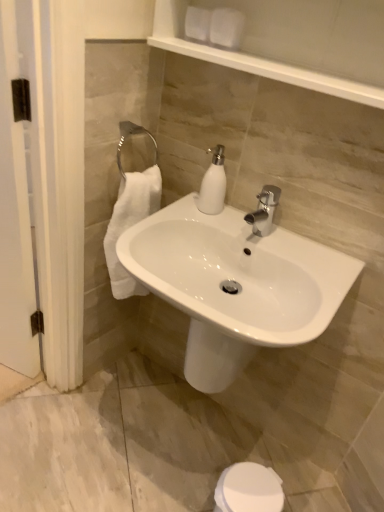
In order to click on vacant point to the right of white wood screen door at left in this screenshot , I will do `click(57, 397)`.